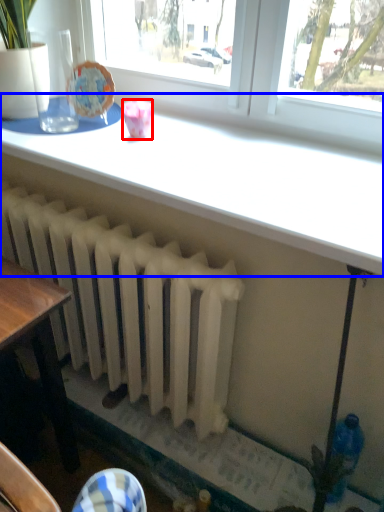
Question: Which point is closer to the camera, tableware (highlighted by a red box) or table (highlighted by a blue box)?

Choices:
 (A) tableware
 (B) table

Answer: (B)